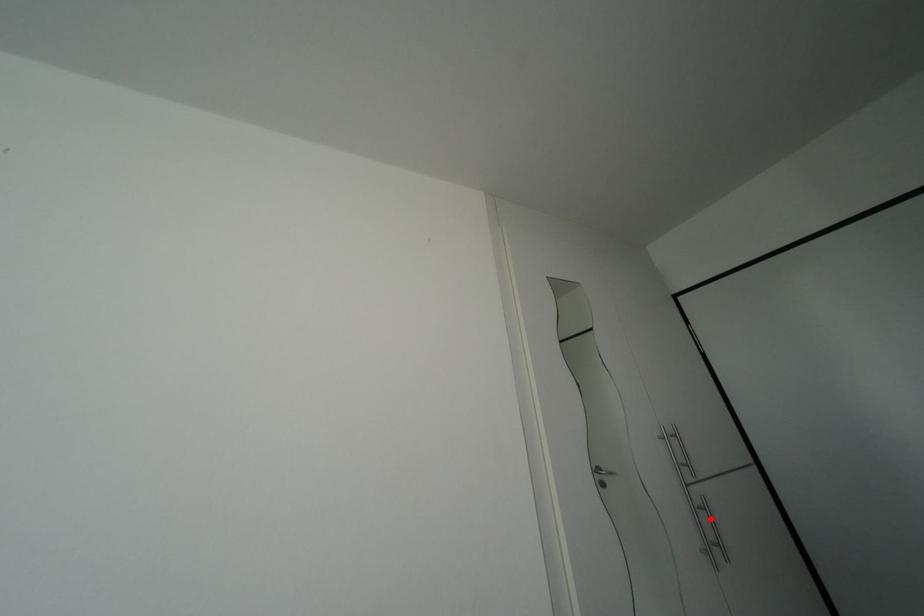
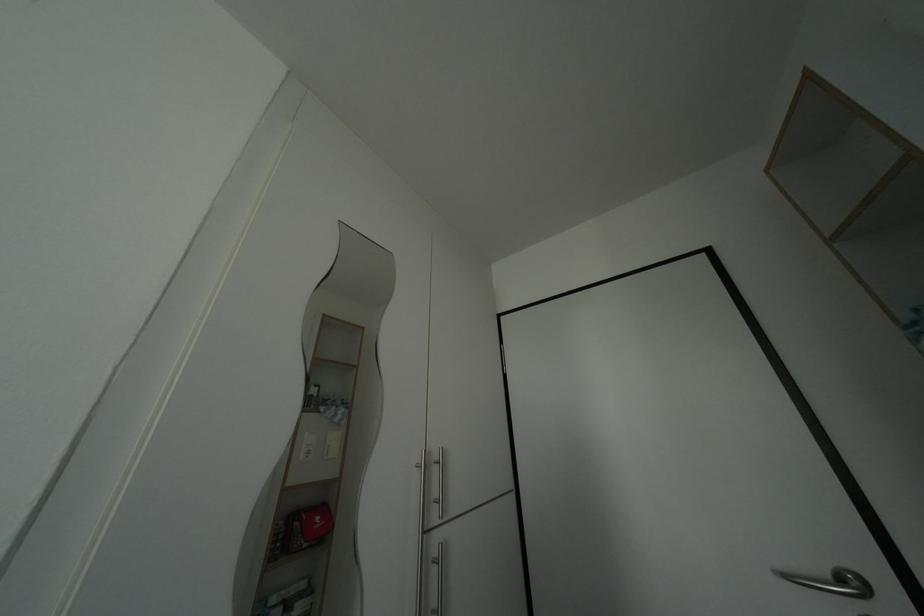
Locate, in the second image, the point that corresponds to the highlighted location in the first image.

(442, 576)